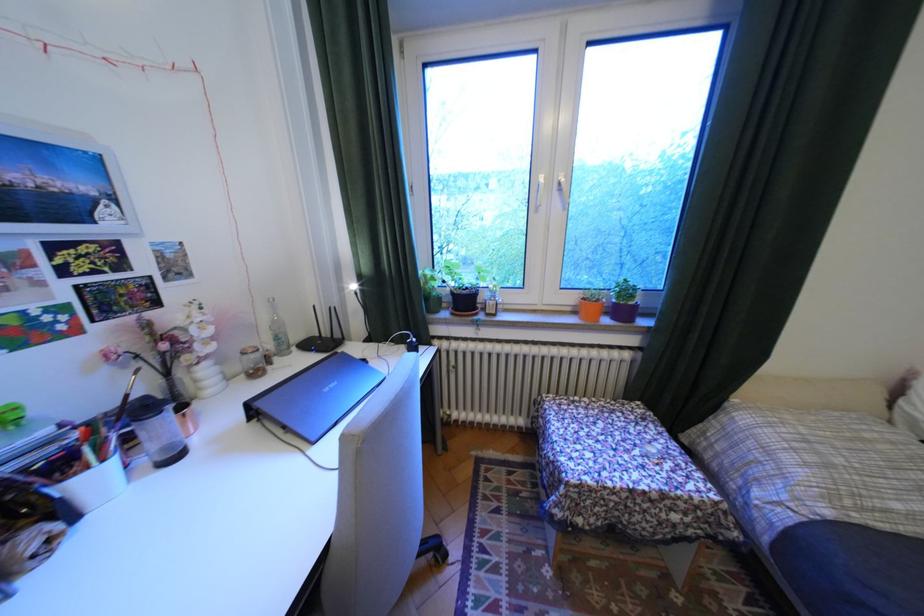
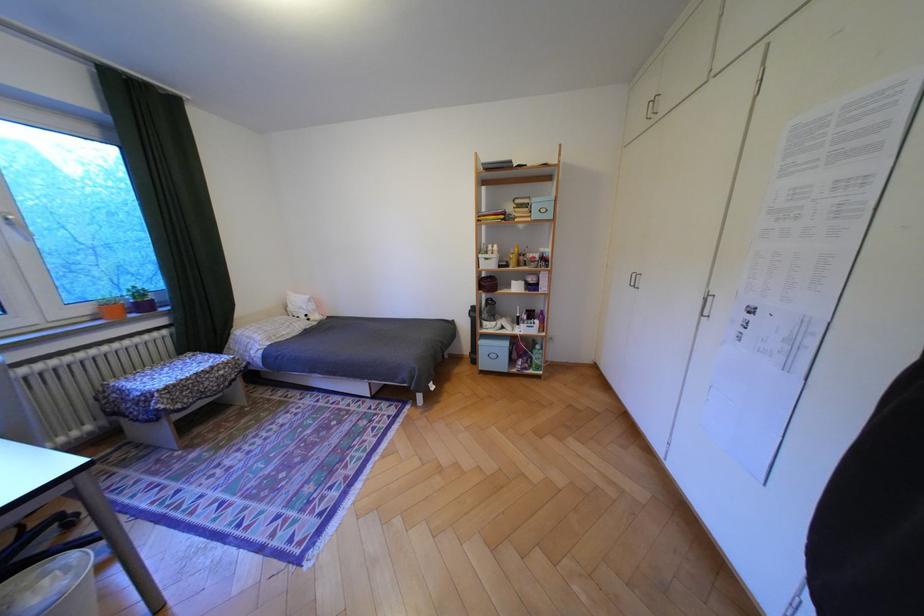
In the second image, find the point that corresponds to [566,195] in the first image.

(18, 227)